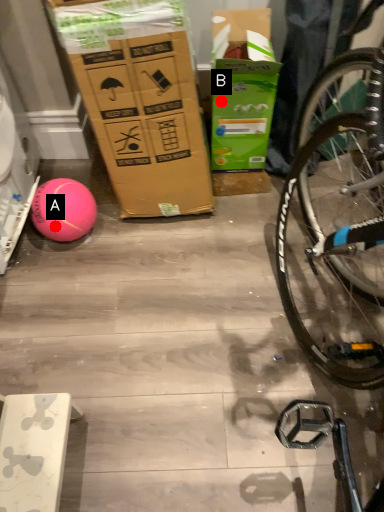
Question: Two points are circled on the image, labeled by A and B beside each circle. Which point is farther to the camera?

Choices:
 (A) A is further
 (B) B is further

Answer: (B)